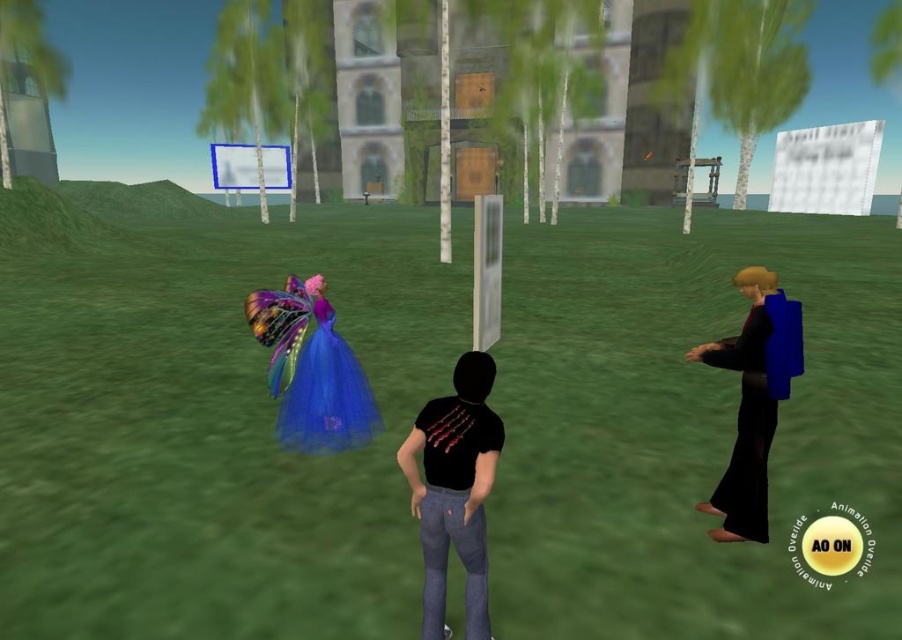
Question: Does black matte t-shirt at center have a greater width compared to metallic blue sign at upper center?

Choices:
 (A) no
 (B) yes

Answer: (A)

Question: Considering the relative positions of shiny blue dress at center and black matte dress at right in the image provided, where is shiny blue dress at center located with respect to black matte dress at right?

Choices:
 (A) below
 (B) above

Answer: (B)

Question: Which point is closer to the camera?

Choices:
 (A) (279, 305)
 (B) (489, 454)
 (C) (757, 428)
 (D) (223, 148)

Answer: (B)

Question: In this image, where is shiny blue dress at center located relative to metallic blue sign at upper center?

Choices:
 (A) left
 (B) right

Answer: (B)

Question: Which object is positioned farthest from the black matte t-shirt at center?

Choices:
 (A) metallic blue sign at upper center
 (B) shiny blue dress at center

Answer: (A)

Question: Based on their relative distances, which object is farther from the metallic blue sign at upper center?

Choices:
 (A) black matte t-shirt at center
 (B) black matte dress at right
 (C) shiny blue dress at center

Answer: (B)